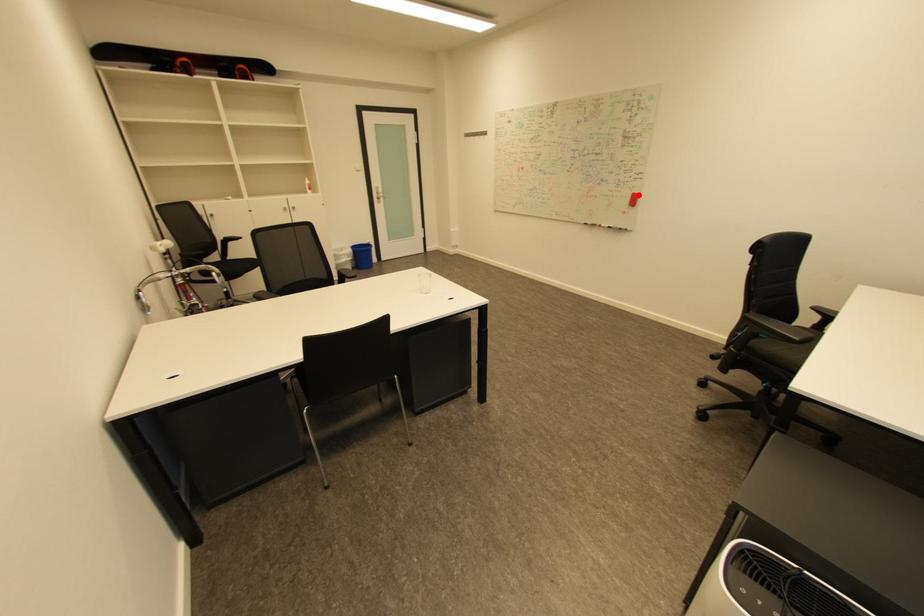
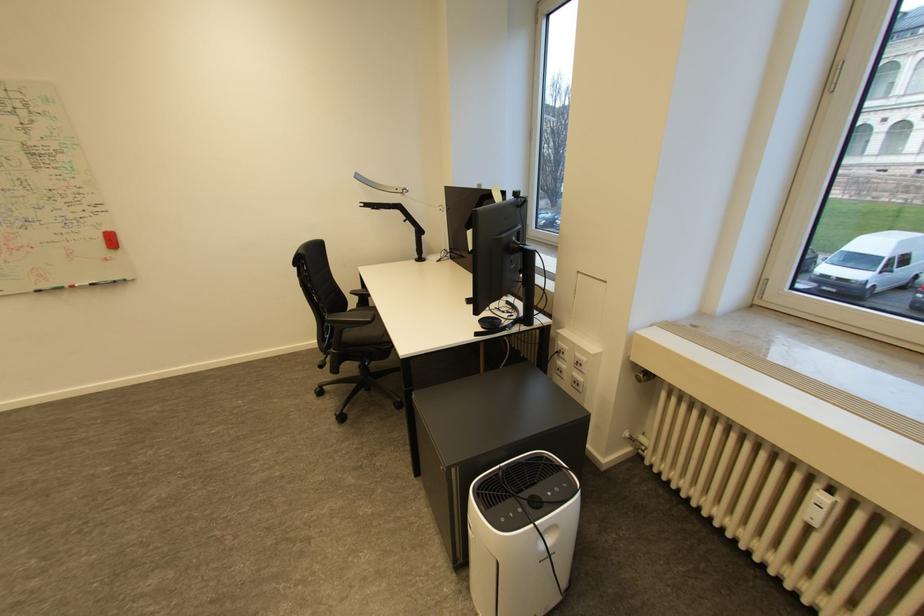
Question: I am providing you with two images of the same scene from different viewpoints. A red point is shown in image1. For the corresponding object point in image2, is it positioned nearer or farther from the camera?

Choices:
 (A) Nearer
 (B) Farther

Answer: (B)